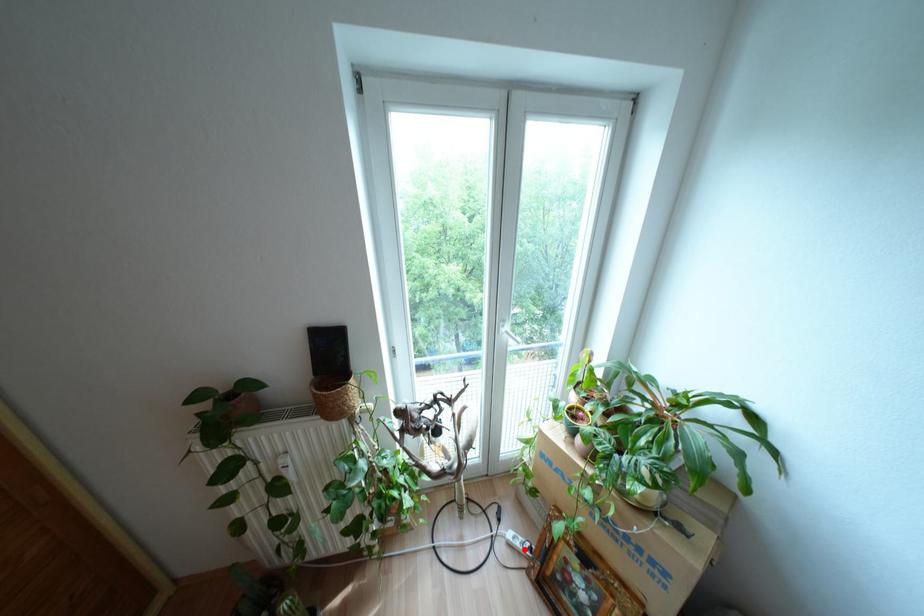
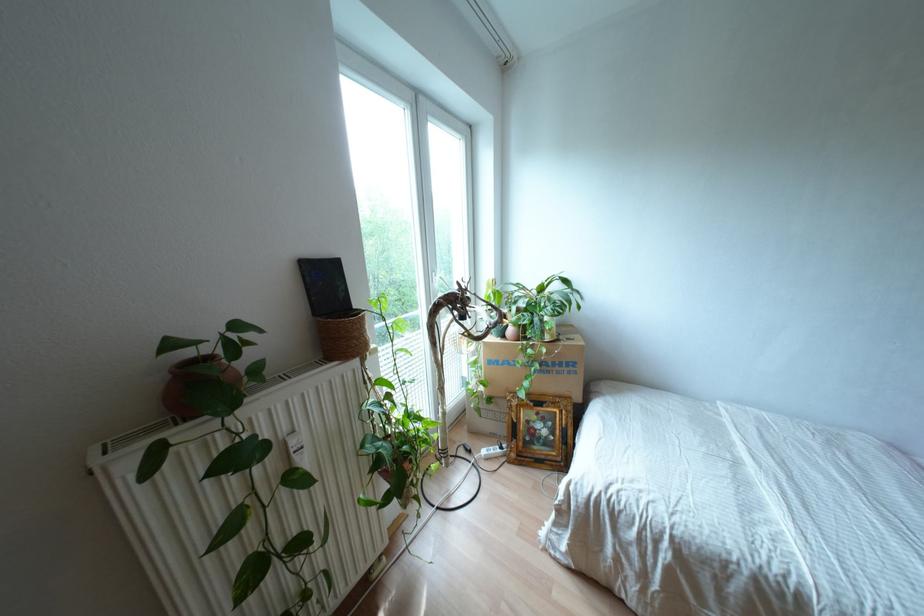
Where in the second image is the point corresponding to the highlighted location from the first image?

(497, 450)